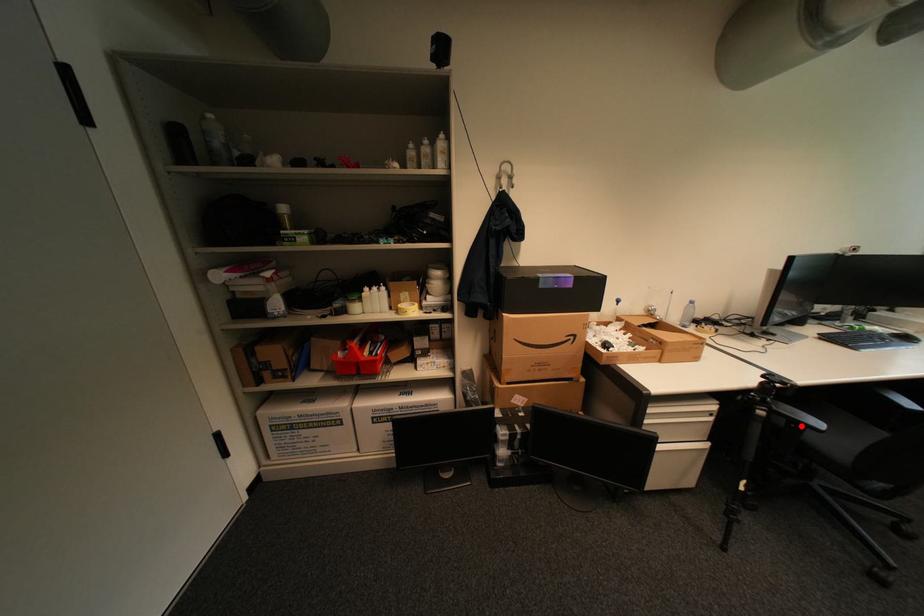
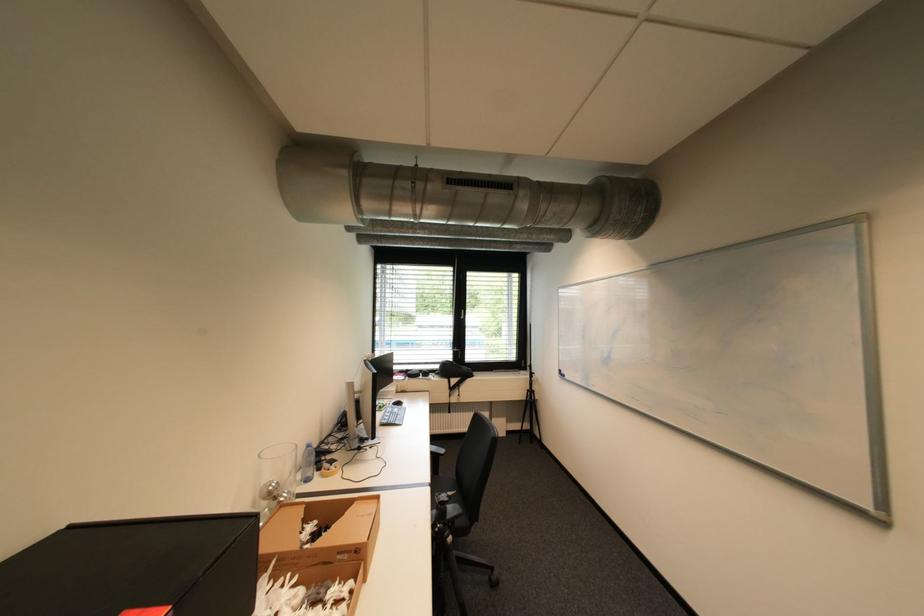
Question: I am providing you with two images of the same scene from different viewpoints. Image1 has a red point marked. In image2, the corresponding 3D location appears at what relative position? Reply with the corresponding letter.

Choices:
 (A) Closer
 (B) Farther

Answer: (B)